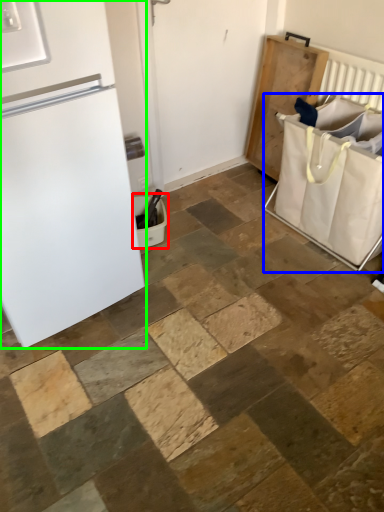
Question: Which object is the closest to the laundry basket (highlighted by a red box)? Choose among these: laundry basket (highlighted by a blue box) or refrigerator (highlighted by a green box).

Choices:
 (A) laundry basket
 (B) refrigerator

Answer: (B)